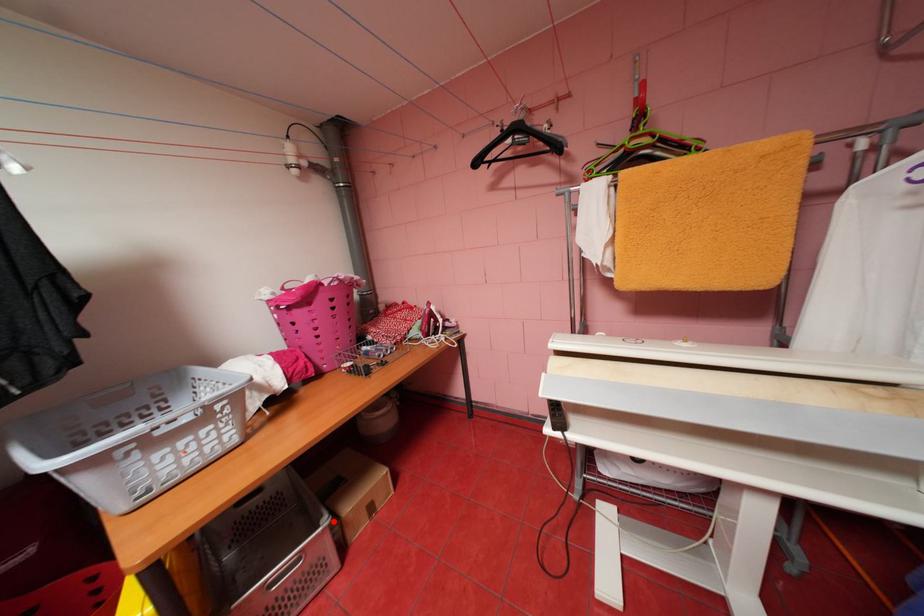
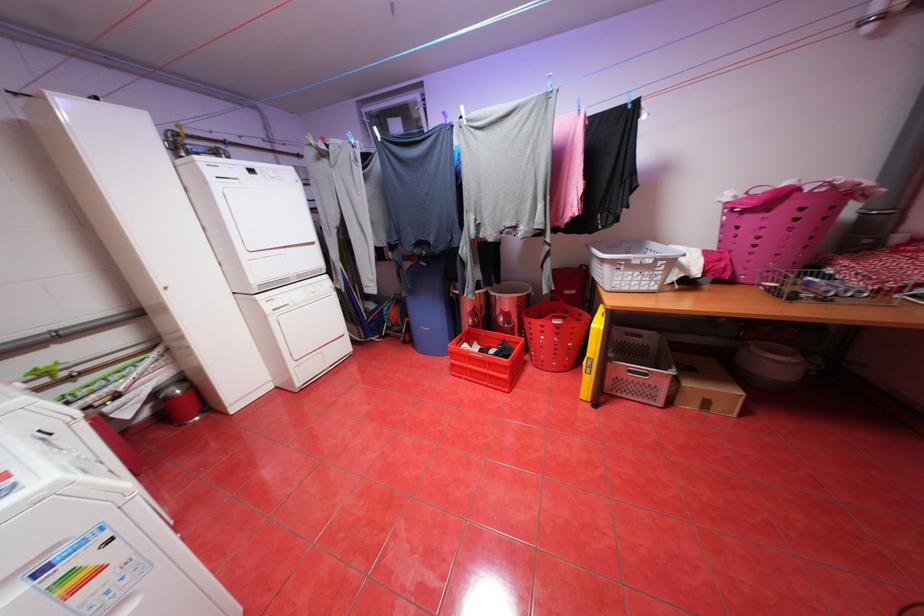
Question: I am providing you with two images of the same scene from different viewpoints. A red point is marked on the first image. At the location where the point appears in image 1, is it still visible in image 2?

Choices:
 (A) Yes
 (B) No

Answer: (A)